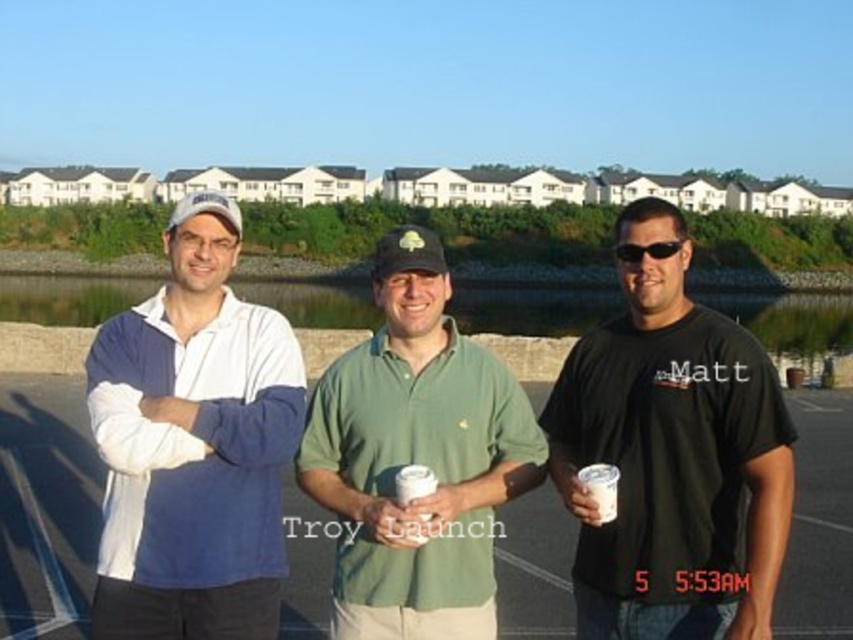
Based on the scene description, can you determine if the white cotton polo shirt at left has a larger width compared to the green cotton polo shirt at center?

The white cotton polo shirt at left might be wider than green cotton polo shirt at center according to the description provided.